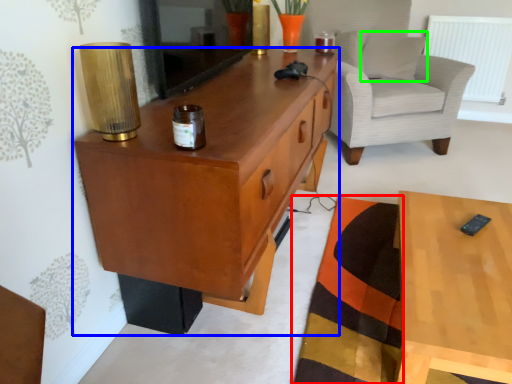
Question: Estimate the real-world distances between objects in this image. Which object is farther from mat (highlighted by a red box), cabinetry (highlighted by a blue box) or pillow (highlighted by a green box)?

Choices:
 (A) cabinetry
 (B) pillow

Answer: (B)